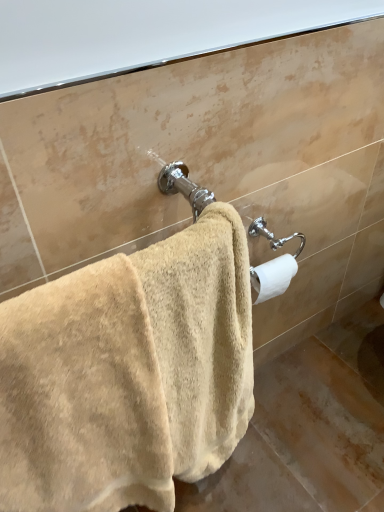
Describe the element at coordinates (273, 277) in the screenshot. This screenshot has width=384, height=512. I see `white matte toilet paper at right` at that location.

Where is `white matte toilet paper at right`? The width and height of the screenshot is (384, 512). white matte toilet paper at right is located at coordinates (273, 277).

The width and height of the screenshot is (384, 512). What do you see at coordinates (128, 373) in the screenshot?
I see `beige plush towel at center` at bounding box center [128, 373].

Measure the distance between point (178, 456) and camera.

38.74 inches.

You are a GUI agent. You are given a task and a screenshot of the screen. Output one action in this format:
    pyautogui.click(x=<x>, y=<y>)
    Task: Click on the beige plush towel at center
    
    Given the screenshot: What is the action you would take?
    pyautogui.click(x=128, y=373)

Measure the distance between beige plush towel at center and camera.

21.42 inches.

Image resolution: width=384 pixels, height=512 pixels. Identify the location of white matte toilet paper at right. (273, 277).

Considering the positions of objects beige plush towel at center and white matte toilet paper at right in the image provided, who is more to the right, beige plush towel at center or white matte toilet paper at right?

From the viewer's perspective, white matte toilet paper at right appears more on the right side.

Does beige plush towel at center lie in front of white matte toilet paper at right?

Yes, beige plush towel at center is in front of white matte toilet paper at right.

Which is less distant, (118, 295) or (265, 269)?

Point (118, 295) is positioned closer to the camera compared to point (265, 269).

From the image's perspective, is beige plush towel at center beneath white matte toilet paper at right?

Correct, beige plush towel at center appears lower than white matte toilet paper at right in the image.

From a real-world perspective, is beige plush towel at center located beneath white matte toilet paper at right?

Correct, in the physical world, beige plush towel at center is lower than white matte toilet paper at right.

Is beige plush towel at center wider or thinner than white matte toilet paper at right?

Clearly, beige plush towel at center has more width compared to white matte toilet paper at right.

Is beige plush towel at center shorter than white matte toilet paper at right?

Incorrect, the height of beige plush towel at center does not fall short of that of white matte toilet paper at right.

Considering the relative sizes of beige plush towel at center and white matte toilet paper at right in the image provided, is beige plush towel at center smaller than white matte toilet paper at right?

Actually, beige plush towel at center might be larger than white matte toilet paper at right.

Is white matte toilet paper at right located within beige plush towel at center?

Definitely not — white matte toilet paper at right is not inside beige plush towel at center.

Consider the image. Can you see beige plush towel at center touching white matte toilet paper at right?

No, beige plush towel at center is not beside white matte toilet paper at right.

Does beige plush towel at center turn towards white matte toilet paper at right?

No, beige plush towel at center is not turned towards white matte toilet paper at right.

What's the angular difference between beige plush towel at center and white matte toilet paper at right's facing directions?

The facing directions of beige plush towel at center and white matte toilet paper at right are 4.35 degrees apart.

Image resolution: width=384 pixels, height=512 pixels. Identify the location of toilet paper behind the beige plush towel at center. (273, 277).

Which is more to the left, white matte toilet paper at right or beige plush towel at center?

Positioned to the left is beige plush towel at center.

Is white matte toilet paper at right positioned before beige plush towel at center?

No, white matte toilet paper at right is further to the viewer.

From the picture: Which is farther, (295,271) or (142,439)?

The point (295,271) is farther from the camera.

From the image's perspective, between white matte toilet paper at right and beige plush towel at center, which one is located above?

white matte toilet paper at right appears higher in the image.

From a real-world perspective, is white matte toilet paper at right above or below beige plush towel at center?

white matte toilet paper at right is situated higher than beige plush towel at center in the real world.

Can you confirm if white matte toilet paper at right is thinner than beige plush towel at center?

Yes, white matte toilet paper at right is thinner than beige plush towel at center.

Considering the sizes of objects white matte toilet paper at right and beige plush towel at center in the image provided, who is taller, white matte toilet paper at right or beige plush towel at center?

Standing taller between the two is beige plush towel at center.

Is white matte toilet paper at right bigger than beige plush towel at center?

Actually, white matte toilet paper at right might be smaller than beige plush towel at center.

Is white matte toilet paper at right inside or outside of beige plush towel at center?

white matte toilet paper at right is located beyond the bounds of beige plush towel at center.

Consider the image. Is white matte toilet paper at right touching beige plush towel at center?

No, white matte toilet paper at right is not in contact with beige plush towel at center.

Does white matte toilet paper at right turn towards beige plush towel at center?

No.

How many degrees apart are the facing directions of white matte toilet paper at right and beige plush towel at center?

They differ by 4.35 degrees in their facing directions.

Locate an element on the screen. This screenshot has height=512, width=384. toilet paper to the right of beige plush towel at center is located at coordinates (273, 277).

Locate an element on the screen. towel in front of the white matte toilet paper at right is located at coordinates (128, 373).

Where is `toilet paper behind the beige plush towel at center`? toilet paper behind the beige plush towel at center is located at coordinates (273, 277).